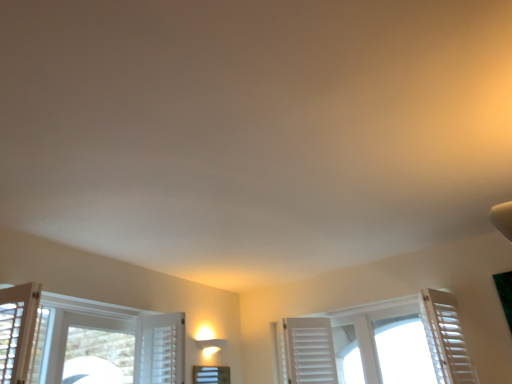
Question: From the image's perspective, is white frosted glass window at center, the 2th window when ordered from right to left, below white wooden shutters at center, placed as the first window when sorted from right to left?

Choices:
 (A) yes
 (B) no

Answer: (A)

Question: Does white frosted glass window at center, which is counted as the 1th window, starting from the left, have a larger size compared to white wooden shutters at center, placed as the 2th window when sorted from left to right?

Choices:
 (A) yes
 (B) no

Answer: (B)

Question: Is white frosted glass window at center, the 2th window when ordered from right to left, taller than white wooden shutters at center, placed as the 2th window when sorted from left to right?

Choices:
 (A) yes
 (B) no

Answer: (B)

Question: Could white wooden shutters at center, placed as the first window when sorted from right to left, be considered to be inside white frosted glass window at center, which is counted as the 1th window, starting from the left?

Choices:
 (A) no
 (B) yes

Answer: (A)

Question: Is white frosted glass window at center, which is counted as the 1th window, starting from the left, smaller than white wooden shutters at center, placed as the 2th window when sorted from left to right?

Choices:
 (A) no
 (B) yes

Answer: (B)

Question: Based on their positions, is white matte shutter at right located to the left or right of white wooden shutters at center, placed as the 2th window when sorted from left to right?

Choices:
 (A) right
 (B) left

Answer: (A)

Question: From the image's perspective, is white matte shutter at right positioned above or below white wooden shutters at center, placed as the first window when sorted from right to left?

Choices:
 (A) above
 (B) below

Answer: (A)

Question: Relative to white wooden shutters at center, placed as the first window when sorted from right to left, is white matte shutter at right in front or behind?

Choices:
 (A) front
 (B) behind

Answer: (A)

Question: Based on their sizes in the image, would you say white matte shutter at right is bigger or smaller than white wooden shutters at center, placed as the 2th window when sorted from left to right?

Choices:
 (A) big
 (B) small

Answer: (B)

Question: Looking at their shapes, would you say white frosted glass window at center, the 2th window when ordered from right to left, is wider or thinner than white matte shutter at right?

Choices:
 (A) wide
 (B) thin

Answer: (B)

Question: From the image's perspective, is white frosted glass window at center, the 2th window when ordered from right to left, located above or below white matte shutter at right?

Choices:
 (A) below
 (B) above

Answer: (A)

Question: Considering the positions of point (200, 370) and point (420, 312), is point (200, 370) closer or farther from the camera than point (420, 312)?

Choices:
 (A) closer
 (B) farther

Answer: (B)

Question: Based on their sizes in the image, would you say white frosted glass window at center, which is counted as the 1th window, starting from the left, is bigger or smaller than white matte shutter at right?

Choices:
 (A) small
 (B) big

Answer: (A)

Question: Relative to white frosted glass window at center, which is counted as the 1th window, starting from the left, is white wooden shutters at center, placed as the first window when sorted from right to left, in front or behind?

Choices:
 (A) behind
 (B) front

Answer: (B)

Question: Choose the correct answer: Is white wooden shutters at center, placed as the 2th window when sorted from left to right, inside white frosted glass window at center, the 2th window when ordered from right to left, or outside it?

Choices:
 (A) outside
 (B) inside

Answer: (A)